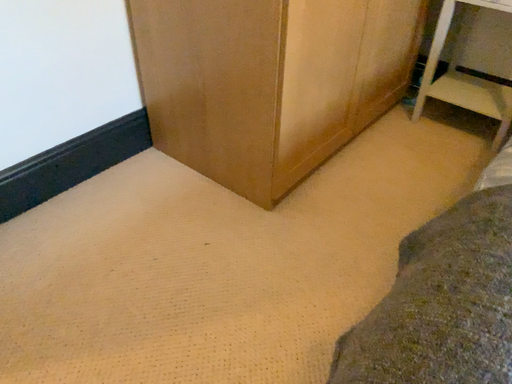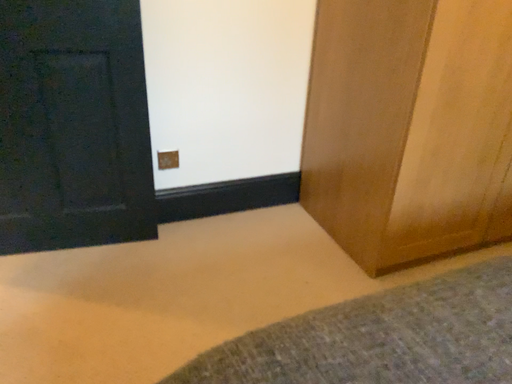
Question: Which way did the camera rotate in the video?

Choices:
 (A) rotated upward
 (B) rotated downward

Answer: (A)